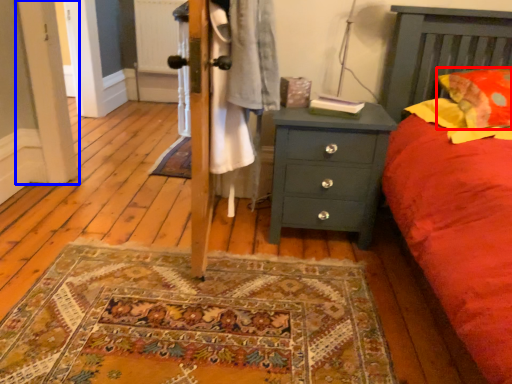
Question: Which of the following is the farthest to the observer, pillow (highlighted by a red box) or screen door (highlighted by a blue box)?

Choices:
 (A) pillow
 (B) screen door

Answer: (B)